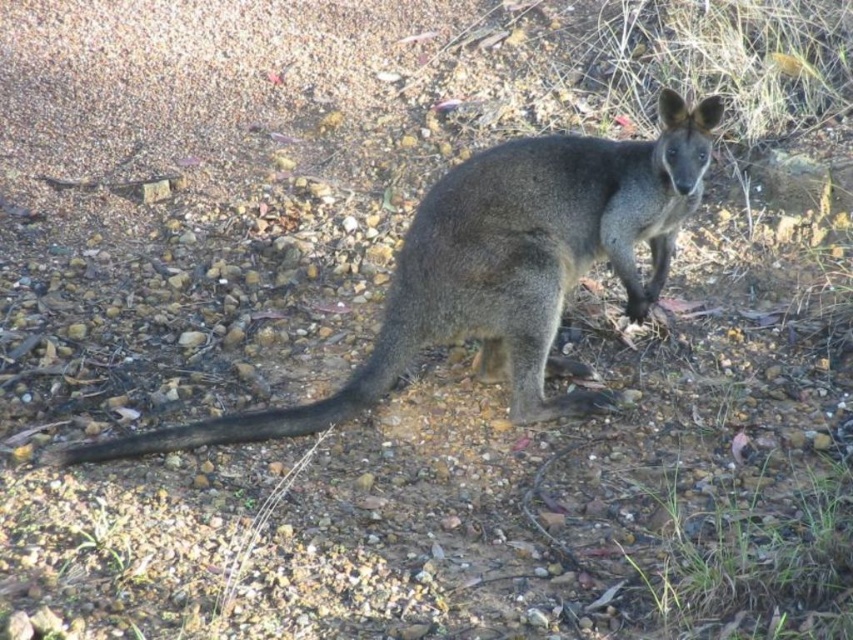
Question: Does gray fur kangaroo at center have a smaller size compared to black fur tail at center?

Choices:
 (A) yes
 (B) no

Answer: (B)

Question: Which of the following is the closest to the observer?

Choices:
 (A) click(177, 433)
 (B) click(430, 240)

Answer: (A)

Question: Can you confirm if gray fur kangaroo at center is positioned below black fur tail at center?

Choices:
 (A) no
 (B) yes

Answer: (A)

Question: Which point is farther to the camera?

Choices:
 (A) (401, 346)
 (B) (142, 436)

Answer: (A)

Question: Which point is farther from the camera taking this photo?

Choices:
 (A) (584, 161)
 (B) (161, 433)

Answer: (A)

Question: Is gray fur kangaroo at center positioned in front of black fur tail at center?

Choices:
 (A) yes
 (B) no

Answer: (B)